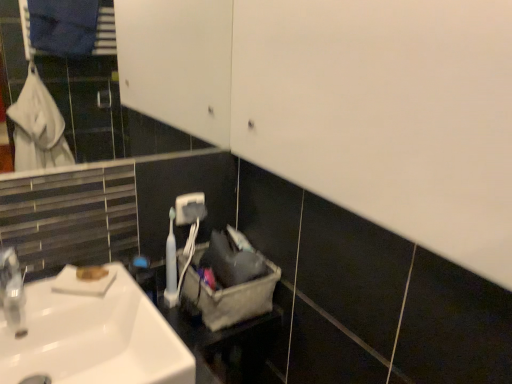
Locate an element on the screen. The width and height of the screenshot is (512, 384). gray fabric laundry basket at center is located at coordinates (229, 295).

This screenshot has height=384, width=512. Find the location of `white plastic toothbrush at center`. white plastic toothbrush at center is located at coordinates (170, 265).

At what (x,y) coordinates should I click in order to perform the action: click on white matte soap at lower left. Please return your answer as a coordinate pair (x, y). The width and height of the screenshot is (512, 384). Looking at the image, I should click on (91, 273).

Is white glossy sink at lower left facing towards white matte soap at lower left?

No, white glossy sink at lower left is not aimed at white matte soap at lower left.

Is white matte soap at lower left completely or partially inside white glossy sink at lower left?

No, white glossy sink at lower left does not contain white matte soap at lower left.

Find the location of a particular element. The width and height of the screenshot is (512, 384). soap above the white glossy sink at lower left (from a real-world perspective) is located at coordinates (91, 273).

From a real-world perspective, which is physically below, white glossy sink at lower left or white matte soap at lower left?

white glossy sink at lower left.

In the image, is white matte soap at lower left on the left side or the right side of white plastic toothbrush at center?

In the image, white matte soap at lower left appears on the left side of white plastic toothbrush at center.

Is white matte soap at lower left positioned beyond the bounds of white plastic toothbrush at center?

Indeed, white matte soap at lower left is completely outside white plastic toothbrush at center.

From the image's perspective, which is below, white matte soap at lower left or white plastic toothbrush at center?

white matte soap at lower left.

How different are the orientations of white matte soap at lower left and white plastic toothbrush at center in degrees?

41.6 degrees separate the facing orientations of white matte soap at lower left and white plastic toothbrush at center.

Is white glossy sink at lower left positioned with its back to gray fabric laundry basket at center?

No, white glossy sink at lower left's orientation is not away from gray fabric laundry basket at center.

Does white glossy sink at lower left appear on the right side of gray fabric laundry basket at center?

No.

How much distance is there between white glossy sink at lower left and gray fabric laundry basket at center?

They are 9.74 inches apart.

Which object is thinner, white glossy sink at lower left or gray fabric laundry basket at center?

gray fabric laundry basket at center.

How different are the orientations of white matte soap at lower left and gray fabric laundry basket at center in degrees?

white matte soap at lower left and gray fabric laundry basket at center are facing 47.7 degrees away from each other.

Which of these two, white matte soap at lower left or gray fabric laundry basket at center, is thinner?

white matte soap at lower left is thinner.

Considering the sizes of white matte soap at lower left and gray fabric laundry basket at center in the image, is white matte soap at lower left taller or shorter than gray fabric laundry basket at center?

Considering their sizes, white matte soap at lower left has less height than gray fabric laundry basket at center.

Can you confirm if white matte soap at lower left is smaller than gray fabric laundry basket at center?

Yes, white matte soap at lower left is smaller than gray fabric laundry basket at center.

Considering the points (47, 293) and (172, 214), which point is in front, point (47, 293) or point (172, 214)?

The point (47, 293) is closer to the camera.

Find the location of a particular element. sink on the left side of white plastic toothbrush at center is located at coordinates (95, 338).

Is white glossy sink at lower left at the left side of white plastic toothbrush at center?

Yes, white glossy sink at lower left is to the left of white plastic toothbrush at center.

Which object is thinner, white glossy sink at lower left or white plastic toothbrush at center?

With smaller width is white plastic toothbrush at center.

What's the angular difference between gray fabric laundry basket at center and white plastic toothbrush at center's facing directions?

6.1 degrees.

Visually, is gray fabric laundry basket at center positioned to the left or to the right of white plastic toothbrush at center?

gray fabric laundry basket at center is positioned on white plastic toothbrush at center's right side.

Is gray fabric laundry basket at center far away from white plastic toothbrush at center?

That's not correct — gray fabric laundry basket at center is a little close to white plastic toothbrush at center.

Which of these two, gray fabric laundry basket at center or white plastic toothbrush at center, is smaller?

white plastic toothbrush at center is smaller.

From a real-world perspective, which is physically below, white plastic toothbrush at center or white matte soap at lower left?

white plastic toothbrush at center is physically lower.

Looking at the image, does white plastic toothbrush at center seem bigger or smaller compared to white matte soap at lower left?

In the image, white plastic toothbrush at center appears to be larger than white matte soap at lower left.

Does white plastic toothbrush at center have a greater height compared to white matte soap at lower left?

Yes.

Can you see white plastic toothbrush at center touching white matte soap at lower left?

They are not placed beside each other.

Find the location of `soap that is behind the white glossy sink at lower left`. soap that is behind the white glossy sink at lower left is located at coordinates (91, 273).

Identify the location of soap below the white plastic toothbrush at center (from the image's perspective). (91, 273).

Which object lies further to the anchor point gray fabric laundry basket at center, white plastic toothbrush at center or white matte soap at lower left?

The object further to gray fabric laundry basket at center is white matte soap at lower left.

Looking at the image, which one is located further to white plastic toothbrush at center, gray fabric laundry basket at center or white matte soap at lower left?

The object further to white plastic toothbrush at center is white matte soap at lower left.

Which object lies further to the anchor point gray fabric laundry basket at center, white matte soap at lower left or white plastic toothbrush at center?

white matte soap at lower left is positioned further to the anchor gray fabric laundry basket at center.

From the image, which object appears to be nearer to gray fabric laundry basket at center, white matte soap at lower left or white glossy sink at lower left?

white glossy sink at lower left is closer to gray fabric laundry basket at center.

From the image, which object appears to be farther from white plastic toothbrush at center, white glossy sink at lower left or white matte soap at lower left?

The object further to white plastic toothbrush at center is white glossy sink at lower left.

From the image, which object appears to be farther from gray fabric laundry basket at center, white glossy sink at lower left or white plastic toothbrush at center?

Among the two, white glossy sink at lower left is located further to gray fabric laundry basket at center.

Considering their positions, is gray fabric laundry basket at center positioned closer to white plastic toothbrush at center than white glossy sink at lower left?

gray fabric laundry basket at center lies closer to white plastic toothbrush at center than the other object.

Estimate the real-world distances between objects in this image. Which object is further from white matte soap at lower left, gray fabric laundry basket at center or white plastic toothbrush at center?

gray fabric laundry basket at center lies further to white matte soap at lower left than the other object.

Find the location of a particular element. This screenshot has width=512, height=384. laundry basket between white glossy sink at lower left and white plastic toothbrush at center along the z-axis is located at coordinates (229, 295).

At what (x,y) coordinates should I click in order to perform the action: click on soap between white glossy sink at lower left and gray fabric laundry basket at center along the z-axis. Please return your answer as a coordinate pair (x, y). The height and width of the screenshot is (384, 512). Looking at the image, I should click on (91, 273).

Where is `toiletry between white matte soap at lower left and gray fabric laundry basket at center in the horizontal direction`? Image resolution: width=512 pixels, height=384 pixels. toiletry between white matte soap at lower left and gray fabric laundry basket at center in the horizontal direction is located at coordinates (170, 265).

You are a GUI agent. You are given a task and a screenshot of the screen. Output one action in this format:
    pyautogui.click(x=<x>, y=<y>)
    Task: Click on the soap located between white glossy sink at lower left and white plastic toothbrush at center in the depth direction
    
    Given the screenshot: What is the action you would take?
    point(91,273)